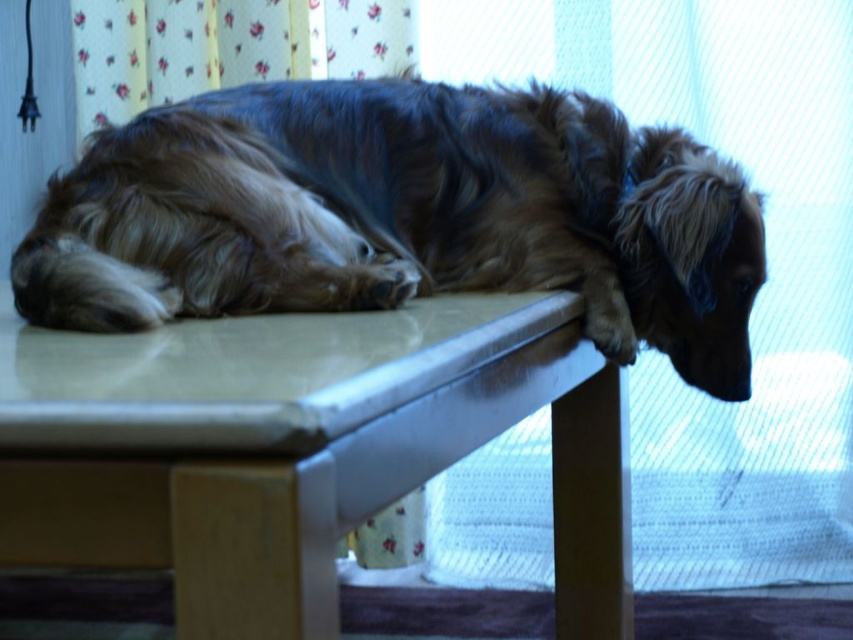
You are a photographer setting up a shoot in this room. You want to place a large tripod between the smooth beige table at center and the floral fabric curtain at upper center. Based on their positions, which object should the tripod be closer to?

The smooth beige table at center is positioned on the right side of the floral fabric curtain at upper center, so the tripod should be placed closer to the smooth beige table at center to ensure it is between both objects.

You are a photographer setting up a shoot. You want to position a camera on the smooth beige table at center so that it can capture the brown shaggy dog at upper center from above. Is the table positioned in a way that allows this setup?

The smooth beige table at center is behind the brown shaggy dog at upper center, so placing the camera on the table would allow it to capture the dog from above since the table is positioned behind the dog.